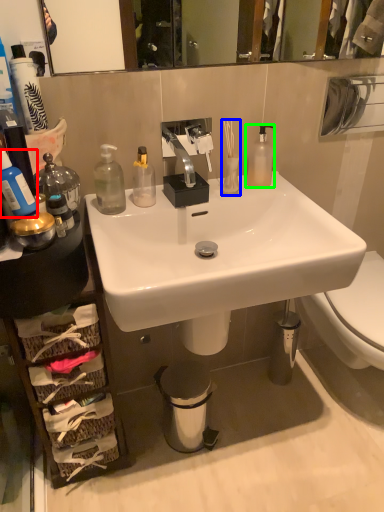
Question: Based on their relative distances, which object is farther from bottle (highlighted by a red box)? Choose from toiletry (highlighted by a blue box) and bottle (highlighted by a green box).

Choices:
 (A) toiletry
 (B) bottle

Answer: (B)